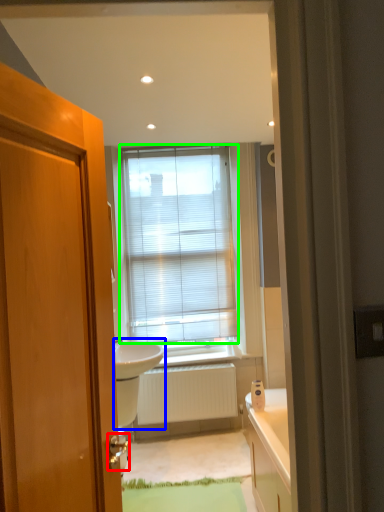
Question: Which is farther away from door handle (highlighted by a red box)? sink (highlighted by a blue box) or window blind (highlighted by a green box)?

Choices:
 (A) sink
 (B) window blind

Answer: (B)